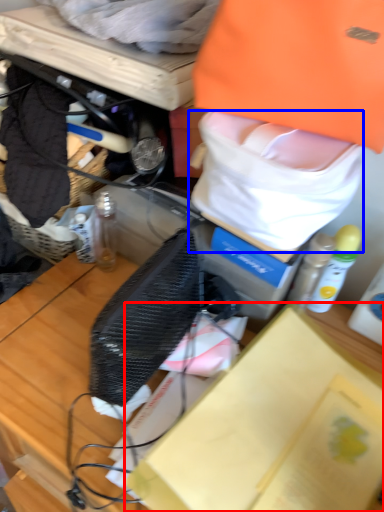
Question: Which object appears farthest to the camera in this image, box (highlighted by a red box) or tote bag (highlighted by a blue box)?

Choices:
 (A) box
 (B) tote bag

Answer: (B)